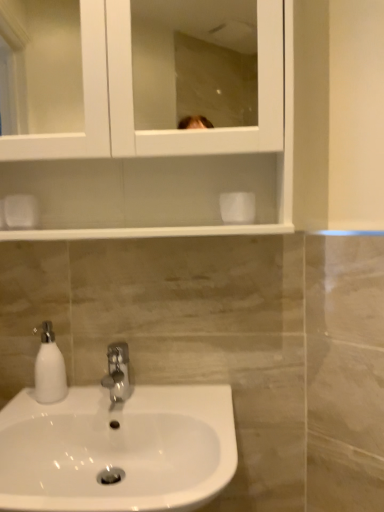
The image size is (384, 512). I want to click on white glossy sink at lower left, so click(117, 449).

Based on the photo, in order to face polished chrome faucet at center, should I rotate leftwards or rightwards?

You should rotate left by 10.379 degrees.

Identify the location of white glossy soap dispenser at lower left. This screenshot has height=512, width=384. (49, 368).

From the image's perspective, which one is positioned higher, white glossy sink at lower left or white glossy soap dispenser at lower left?

white glossy soap dispenser at lower left.

Which is in front, white glossy sink at lower left or white glossy soap dispenser at lower left?

Positioned in front is white glossy sink at lower left.

Is white glossy sink at lower left aimed at white glossy soap dispenser at lower left?

No, white glossy sink at lower left is not aimed at white glossy soap dispenser at lower left.

Between white glossy sink at lower left and white glossy soap dispenser at lower left, which one appears on the left side from the viewer's perspective?

white glossy soap dispenser at lower left.

Which object is further away from the camera, white glossy medicine cabinet at upper center or polished chrome faucet at center?

polished chrome faucet at center.

From a real-world perspective, between white glossy medicine cabinet at upper center and polished chrome faucet at center, who is vertically lower?

In real-world perspective, polished chrome faucet at center is lower.

Which object is wider, white glossy medicine cabinet at upper center or polished chrome faucet at center?

With larger width is polished chrome faucet at center.

Considering their positions, is white glossy soap dispenser at lower left located in front of or behind white glossy medicine cabinet at upper center?

In the image, white glossy soap dispenser at lower left appears behind white glossy medicine cabinet at upper center.

Is there a large distance between white glossy soap dispenser at lower left and white glossy medicine cabinet at upper center?

That's not correct — white glossy soap dispenser at lower left is a little close to white glossy medicine cabinet at upper center.

This screenshot has height=512, width=384. In order to click on soap dispenser on the left of white glossy medicine cabinet at upper center in this screenshot , I will do `click(49, 368)`.

Is the position of white glossy soap dispenser at lower left more distant than that of polished chrome faucet at center?

That is True.

Which object is positioned more to the left, white glossy soap dispenser at lower left or polished chrome faucet at center?

white glossy soap dispenser at lower left is more to the left.

From a real-world perspective, between white glossy soap dispenser at lower left and polished chrome faucet at center, who is vertically lower?

polished chrome faucet at center, from a real-world perspective.

Considering the sizes of white glossy medicine cabinet at upper center and white glossy soap dispenser at lower left in the image, is white glossy medicine cabinet at upper center bigger or smaller than white glossy soap dispenser at lower left?

In the image, white glossy medicine cabinet at upper center appears to be larger than white glossy soap dispenser at lower left.

Which is in front, point (284, 194) or point (63, 367)?

Point (284, 194)

From the image's perspective, who appears lower, white glossy medicine cabinet at upper center or white glossy soap dispenser at lower left?

white glossy soap dispenser at lower left.

Identify the location of soap dispenser located behind the white glossy medicine cabinet at upper center. (49, 368).

Between white glossy medicine cabinet at upper center and white glossy sink at lower left, which one has less height?

With less height is white glossy sink at lower left.

Identify the location of medicine cabinet on the right of white glossy sink at lower left. This screenshot has height=512, width=384. (157, 149).

Consider the image. Is white glossy medicine cabinet at upper center facing away from white glossy sink at lower left?

No, white glossy sink at lower left is not at the back of white glossy medicine cabinet at upper center.

Is polished chrome faucet at center positioned beyond the bounds of white glossy medicine cabinet at upper center?

That's correct, polished chrome faucet at center is outside of white glossy medicine cabinet at upper center.

What are the coordinates of `medicine cabinet above the polished chrome faucet at center (from the image's perspective)` in the screenshot? It's located at (157, 149).

Between polished chrome faucet at center and white glossy medicine cabinet at upper center, which one has less height?

polished chrome faucet at center.

From a real-world perspective, is polished chrome faucet at center located higher than white glossy medicine cabinet at upper center?

No, from a real-world perspective, polished chrome faucet at center is not over white glossy medicine cabinet at upper center

Locate an element on the screen. This screenshot has width=384, height=512. soap dispenser above the white glossy sink at lower left (from a real-world perspective) is located at coordinates (49, 368).

In order to click on tap that is on the left side of white glossy medicine cabinet at upper center in this screenshot , I will do `click(117, 371)`.

Which object lies nearer to the anchor point white glossy sink at lower left, white glossy medicine cabinet at upper center or white glossy soap dispenser at lower left?

white glossy soap dispenser at lower left.

Estimate the real-world distances between objects in this image. Which object is closer to polished chrome faucet at center, white glossy soap dispenser at lower left or white glossy sink at lower left?

white glossy soap dispenser at lower left is closer to polished chrome faucet at center.

When comparing their distances from white glossy soap dispenser at lower left, does white glossy sink at lower left or white glossy medicine cabinet at upper center seem further?

Based on the image, white glossy medicine cabinet at upper center appears to be further to white glossy soap dispenser at lower left.

From the image, which object appears to be nearer to white glossy medicine cabinet at upper center, polished chrome faucet at center or white glossy sink at lower left?

polished chrome faucet at center is positioned closer to the anchor white glossy medicine cabinet at upper center.

From the image, which object appears to be farther from white glossy soap dispenser at lower left, polished chrome faucet at center or white glossy medicine cabinet at upper center?

white glossy medicine cabinet at upper center is positioned further to the anchor white glossy soap dispenser at lower left.

Looking at the image, which one is located further to polished chrome faucet at center, white glossy sink at lower left or white glossy soap dispenser at lower left?

white glossy sink at lower left lies further to polished chrome faucet at center than the other object.

Looking at the image, which one is located further to polished chrome faucet at center, white glossy medicine cabinet at upper center or white glossy soap dispenser at lower left?

The object further to polished chrome faucet at center is white glossy medicine cabinet at upper center.

Based on their spatial positions, is white glossy soap dispenser at lower left or white glossy medicine cabinet at upper center further from white glossy sink at lower left?

Among the two, white glossy medicine cabinet at upper center is located further to white glossy sink at lower left.

Where is `tap located between white glossy sink at lower left and white glossy soap dispenser at lower left in the depth direction`? Image resolution: width=384 pixels, height=512 pixels. tap located between white glossy sink at lower left and white glossy soap dispenser at lower left in the depth direction is located at coordinates (117, 371).

You are a GUI agent. You are given a task and a screenshot of the screen. Output one action in this format:
    pyautogui.click(x=<x>, y=<y>)
    Task: Click on the soap dispenser between white glossy medicine cabinet at upper center and polished chrome faucet at center in the vertical direction
    
    Given the screenshot: What is the action you would take?
    pyautogui.click(x=49, y=368)

Identify the location of soap dispenser between white glossy medicine cabinet at upper center and white glossy sink at lower left in the up-down direction. click(49, 368).

You are a GUI agent. You are given a task and a screenshot of the screen. Output one action in this format:
    pyautogui.click(x=<x>, y=<y>)
    Task: Click on the tap between white glossy medicine cabinet at upper center and white glossy sink at lower left vertically
    Image resolution: width=384 pixels, height=512 pixels.
    Given the screenshot: What is the action you would take?
    pyautogui.click(x=117, y=371)